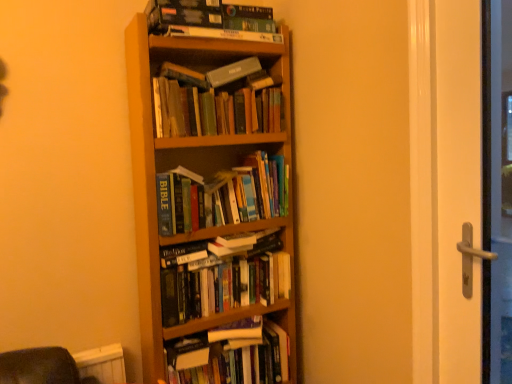
This screenshot has width=512, height=384. What do you see at coordinates (231, 356) in the screenshot?
I see `hardcover book at center, which appears as the first book when ordered from the bottom` at bounding box center [231, 356].

What do you see at coordinates (209, 21) in the screenshot? Image resolution: width=512 pixels, height=384 pixels. I see `hardcover book at upper center, marked as the first book in a top-to-bottom arrangement` at bounding box center [209, 21].

This screenshot has width=512, height=384. I want to click on hardcover books at center, the 2th book when ordered from bottom to top, so click(225, 282).

This screenshot has width=512, height=384. In order to click on hardcover books at upper center, the 2th book positioned from the top in this screenshot , I will do `click(216, 102)`.

Which of these two, hardcover book at center, arranged as the sixth book when viewed from the top, or hardcover book at upper center, which appears as the 6th book when ordered from the bottom, stands taller?

Standing taller between the two is hardcover book at center, arranged as the sixth book when viewed from the top.

From a real-world perspective, is hardcover book at center, which appears as the first book when ordered from the bottom, positioned above or below hardcover book at upper center, which appears as the 6th book when ordered from the bottom?

hardcover book at center, which appears as the first book when ordered from the bottom, is situated lower than hardcover book at upper center, which appears as the 6th book when ordered from the bottom, in the real world.

How different are the orientations of hardcover book at center, which appears as the first book when ordered from the bottom, and hardcover book at upper center, which appears as the 6th book when ordered from the bottom, in degrees?

0.187 degrees.

Which object is positioned more to the right, hardcover book at center, which appears as the first book when ordered from the bottom, or hardcover book at upper center, which appears as the 6th book when ordered from the bottom?

From the viewer's perspective, hardcover book at center, which appears as the first book when ordered from the bottom, appears more on the right side.

Is hardcover gray book at upper center not inside hardcover books at center, the 3th book when ordered from top to bottom?

hardcover gray book at upper center lies outside hardcover books at center, the 3th book when ordered from top to bottom,'s area.

Can you confirm if hardcover gray book at upper center is thinner than hardcover books at center, the 4th book when ordered from bottom to top?

Yes, hardcover gray book at upper center is thinner than hardcover books at center, the 4th book when ordered from bottom to top.

Where is `paperback book above the hardcover books at center, the 4th book when ordered from bottom to top (from a real-world perspective)`? paperback book above the hardcover books at center, the 4th book when ordered from bottom to top (from a real-world perspective) is located at coordinates (233, 72).

Considering the positions of points (253, 70) and (174, 209), is point (253, 70) closer to camera compared to point (174, 209)?

No, it is behind (174, 209).

Is wooden bookcase at center spatially inside hardcover books at upper center, the 5th book ordered from the bottom, or outside of it?

wooden bookcase at center cannot be found inside hardcover books at upper center, the 5th book ordered from the bottom.

Based on their sizes in the image, would you say wooden bookcase at center is bigger or smaller than hardcover books at upper center, the 2th book positioned from the top?

In the image, wooden bookcase at center appears to be larger than hardcover books at upper center, the 2th book positioned from the top.

Can you confirm if wooden bookcase at center is wider than hardcover books at upper center, the 2th book positioned from the top?

Indeed, wooden bookcase at center has a greater width compared to hardcover books at upper center, the 2th book positioned from the top.

Is hardcover gray book at upper center completely or partially inside hardcover books at upper center, the 2th book positioned from the top?

No.

Which is in front, hardcover books at upper center, the 5th book ordered from the bottom, or hardcover gray book at upper center?

hardcover books at upper center, the 5th book ordered from the bottom, is more forward.

Does hardcover books at upper center, the 5th book ordered from the bottom, have a greater height compared to hardcover gray book at upper center?

Yes, hardcover books at upper center, the 5th book ordered from the bottom, is taller than hardcover gray book at upper center.

Identify the location of paperback book located behind the hardcover books at upper center, the 2th book positioned from the top. (233, 72).

Considering the positions of points (190, 257) and (183, 275), is point (190, 257) farther from camera compared to point (183, 275)?

Yes, point (190, 257) is behind point (183, 275).

From a real-world perspective, is hardcover books at center, the 3th book positioned from the bottom, positioned above or below hardcover books at center, the 5th book in the top-to-bottom sequence?

hardcover books at center, the 3th book positioned from the bottom, is situated higher than hardcover books at center, the 5th book in the top-to-bottom sequence, in the real world.

Based on the photo, is hardcover books at center, the 3th book positioned from the bottom, directly adjacent to hardcover books at center, the 5th book in the top-to-bottom sequence?

Yes.

In the scene shown: From the image's perspective, who appears lower, hardcover books at center, which is the 4th book from top to bottom, or hardcover books at center, the 2th book when ordered from bottom to top?

hardcover books at center, the 2th book when ordered from bottom to top, from the image's perspective.

Considering the positions of objects wooden bookcase at center and hardcover book at center, which appears as the first book when ordered from the bottom, in the image provided, who is behind, wooden bookcase at center or hardcover book at center, which appears as the first book when ordered from the bottom,?

hardcover book at center, which appears as the first book when ordered from the bottom, is further from the camera.

Does wooden bookcase at center contain hardcover book at center, which appears as the first book when ordered from the bottom?

Yes, hardcover book at center, which appears as the first book when ordered from the bottom, is a part of wooden bookcase at center.

Based on the photo, which of these two, wooden bookcase at center or hardcover book at center, which appears as the first book when ordered from the bottom, is wider?

hardcover book at center, which appears as the first book when ordered from the bottom, is wider.

Who is shorter, wooden bookcase at center or hardcover book at center, which appears as the first book when ordered from the bottom?

Standing shorter between the two is hardcover book at center, which appears as the first book when ordered from the bottom.

Considering the relative sizes of hardcover book at center, arranged as the sixth book when viewed from the top, and hardcover books at upper center, the 2th book positioned from the top, in the image provided, is hardcover book at center, arranged as the sixth book when viewed from the top, thinner than hardcover books at upper center, the 2th book positioned from the top,?

In fact, hardcover book at center, arranged as the sixth book when viewed from the top, might be wider than hardcover books at upper center, the 2th book positioned from the top.

Can you confirm if hardcover book at center, arranged as the sixth book when viewed from the top, is shorter than hardcover books at upper center, the 5th book ordered from the bottom?

In fact, hardcover book at center, arranged as the sixth book when viewed from the top, may be taller than hardcover books at upper center, the 5th book ordered from the bottom.

Is hardcover book at center, arranged as the sixth book when viewed from the top, to the left or to the right of hardcover books at upper center, the 5th book ordered from the bottom, in the image?

Based on their positions, hardcover book at center, arranged as the sixth book when viewed from the top, is located to the right of hardcover books at upper center, the 5th book ordered from the bottom.

Is hardcover book at center, which appears as the first book when ordered from the bottom, oriented towards hardcover books at upper center, the 5th book ordered from the bottom?

No, hardcover book at center, which appears as the first book when ordered from the bottom, is not facing towards hardcover books at upper center, the 5th book ordered from the bottom.

From a real-world perspective, count 5th books upward from the hardcover book at center, arranged as the sixth book when viewed from the top, and point to it. Please provide its 2D coordinates.

[(209, 21)]

From the image's perspective, count 2nd books downward from the hardcover gray book at upper center and point to it. Please provide its 2D coordinates.

[(222, 195)]

Which object lies further to the anchor point hardcover books at upper center, the 5th book ordered from the bottom, hardcover books at center, the 3th book when ordered from top to bottom, or hardcover book at upper center, marked as the first book in a top-to-bottom arrangement?

The object further to hardcover books at upper center, the 5th book ordered from the bottom, is hardcover books at center, the 3th book when ordered from top to bottom.

Considering their positions, is hardcover books at upper center, the 5th book ordered from the bottom, positioned further to hardcover gray book at upper center than hardcover book at center, which appears as the first book when ordered from the bottom?

hardcover book at center, which appears as the first book when ordered from the bottom, is further to hardcover gray book at upper center.

Which object lies further to the anchor point hardcover gray book at upper center, hardcover books at center, the 5th book in the top-to-bottom sequence, or wooden bookcase at center?

Based on the image, hardcover books at center, the 5th book in the top-to-bottom sequence, appears to be further to hardcover gray book at upper center.

Considering their positions, is hardcover gray book at upper center positioned closer to hardcover books at center, the 5th book in the top-to-bottom sequence, than hardcover book at upper center, which appears as the 6th book when ordered from the bottom?

hardcover gray book at upper center is closer to hardcover books at center, the 5th book in the top-to-bottom sequence.

Estimate the real-world distances between objects in this image. Which object is further from hardcover gray book at upper center, hardcover books at center, the 3th book positioned from the bottom, or hardcover books at center, the 3th book when ordered from top to bottom?

Among the two, hardcover books at center, the 3th book positioned from the bottom, is located further to hardcover gray book at upper center.

When comparing their distances from hardcover book at center, arranged as the sixth book when viewed from the top, does hardcover books at center, the 3th book positioned from the bottom, or hardcover books at center, the 2th book when ordered from bottom to top, seem further?

hardcover books at center, the 3th book positioned from the bottom.

Based on their spatial positions, is hardcover book at upper center, which appears as the 6th book when ordered from the bottom, or wooden bookcase at center closer to hardcover books at center, the 2th book when ordered from bottom to top?

wooden bookcase at center.

Which object lies further to the anchor point hardcover books at center, the 3th book positioned from the bottom, hardcover gray book at upper center or hardcover book at upper center, which appears as the 6th book when ordered from the bottom?

hardcover book at upper center, which appears as the 6th book when ordered from the bottom, lies further to hardcover books at center, the 3th book positioned from the bottom, than the other object.

Where is `bookcase that lies between hardcover books at center, the 3th book when ordered from top to bottom, and hardcover books at center, the 2th book when ordered from bottom to top, from top to bottom`? Image resolution: width=512 pixels, height=384 pixels. bookcase that lies between hardcover books at center, the 3th book when ordered from top to bottom, and hardcover books at center, the 2th book when ordered from bottom to top, from top to bottom is located at coordinates (213, 209).

Image resolution: width=512 pixels, height=384 pixels. I want to click on bookcase that lies between hardcover book at upper center, marked as the first book in a top-to-bottom arrangement, and hardcover book at center, which appears as the first book when ordered from the bottom, from top to bottom, so click(x=213, y=209).

Where is `book between hardcover gray book at upper center and hardcover books at center, the 4th book when ordered from bottom to top, in the up-down direction`? The height and width of the screenshot is (384, 512). book between hardcover gray book at upper center and hardcover books at center, the 4th book when ordered from bottom to top, in the up-down direction is located at coordinates (216, 102).

In order to click on paperback book between hardcover book at upper center, marked as the first book in a top-to-bottom arrangement, and hardcover book at center, which appears as the first book when ordered from the bottom, in the up-down direction in this screenshot , I will do `click(233, 72)`.